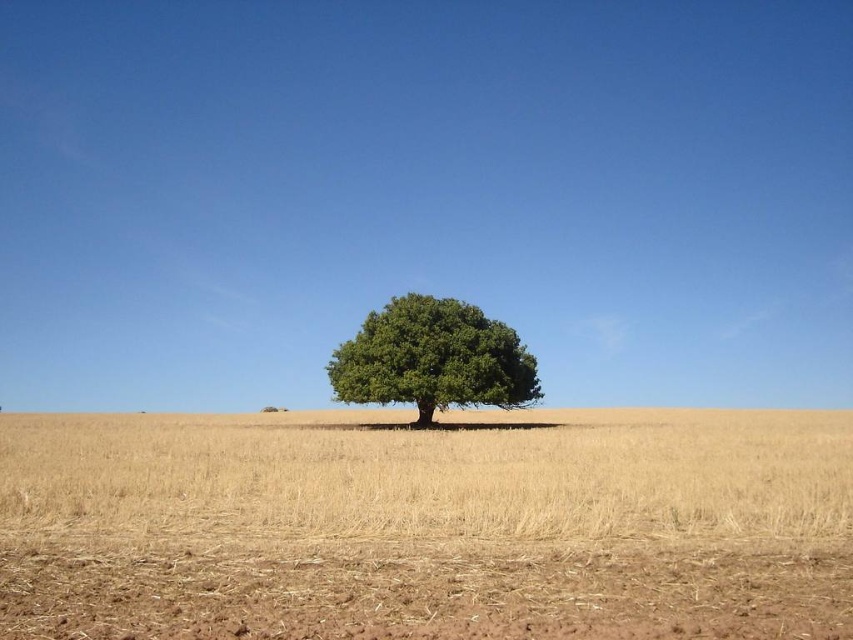
Question: Can you confirm if yellow dry grass at center is positioned below green leafy tree at center?

Choices:
 (A) no
 (B) yes

Answer: (B)

Question: Which point appears farthest from the camera in this image?

Choices:
 (A) (120, 477)
 (B) (381, 330)

Answer: (B)

Question: Observing the image, what is the correct spatial positioning of yellow dry grass at center in reference to green leafy tree at center?

Choices:
 (A) right
 (B) left

Answer: (A)

Question: Which point is closer to the camera?

Choices:
 (A) green leafy tree at center
 (B) yellow dry grass at center

Answer: (B)

Question: From the image, what is the correct spatial relationship of yellow dry grass at center in relation to green leafy tree at center?

Choices:
 (A) right
 (B) left

Answer: (A)